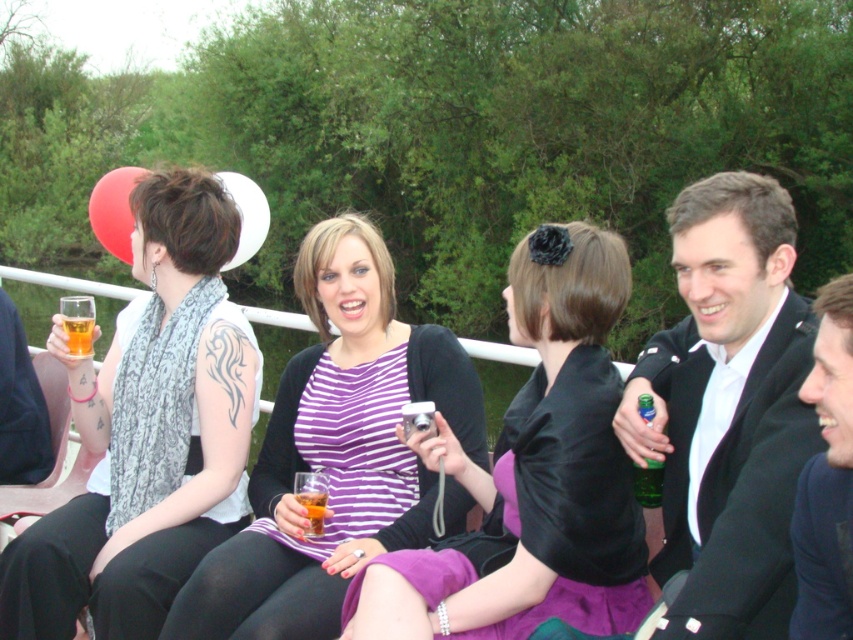
Question: Can you confirm if matte white scarf at left is positioned to the left of purple striped shirt at center?

Choices:
 (A) no
 (B) yes

Answer: (B)

Question: Which is farther from the navy blue suit at right?

Choices:
 (A) purple striped shirt at center
 (B) black satin suit at right

Answer: (A)

Question: Is black satin suit at right closer to the viewer compared to translucent glass at upper left?

Choices:
 (A) yes
 (B) no

Answer: (A)

Question: Is matte white scarf at left above navy blue suit at right?

Choices:
 (A) yes
 (B) no

Answer: (A)

Question: Which object appears farthest from the camera in this image?

Choices:
 (A) striped fabric dress at center
 (B) translucent glass beverage at center
 (C) purple striped shirt at center
 (D) black satin suit at right

Answer: (B)

Question: Which of the following is the farthest from the observer?

Choices:
 (A) matte white scarf at left
 (B) translucent glass beverage at center
 (C) translucent glass at upper left

Answer: (C)